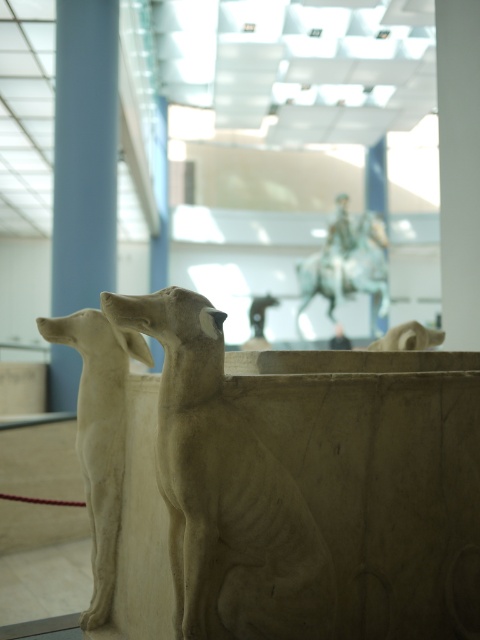
Does blue stone pillar at left have a larger size compared to bronze statue at upper center?

Yes, blue stone pillar at left is bigger than bronze statue at upper center.

Between blue stone pillar at left and bronze statue at upper center, which one appears on the right side from the viewer's perspective?

bronze statue at upper center

I want to click on blue stone pillar at left, so click(x=84, y=154).

Find the location of a particular element. The image size is (480, 640). blue stone pillar at left is located at coordinates (84, 154).

Consider the image. Who is positioned more to the left, white stone dog at center or bronze statue at upper center?

white stone dog at center

Is white stone dog at center above bronze statue at upper center?

Actually, white stone dog at center is below bronze statue at upper center.

Is point (94, 419) behind point (324, 292)?

No, (94, 419) is closer to viewer.

The height and width of the screenshot is (640, 480). I want to click on white stone dog at center, so click(x=99, y=435).

Does beige stone dog at center lie behind white stone dog at center?

No, it is in front of white stone dog at center.

Who is more forward, (210, 524) or (109, 481)?

Point (210, 524) is more forward.

At what (x,y) coordinates should I click in order to perform the action: click on beige stone dog at center. Please return your answer as a coordinate pair (x, y). Looking at the image, I should click on [x=225, y=490].